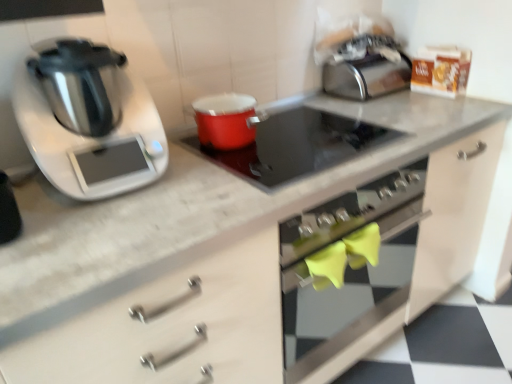
I want to click on vacant space that's between matte red pot at center and satin silver toaster at upper right, so click(303, 110).